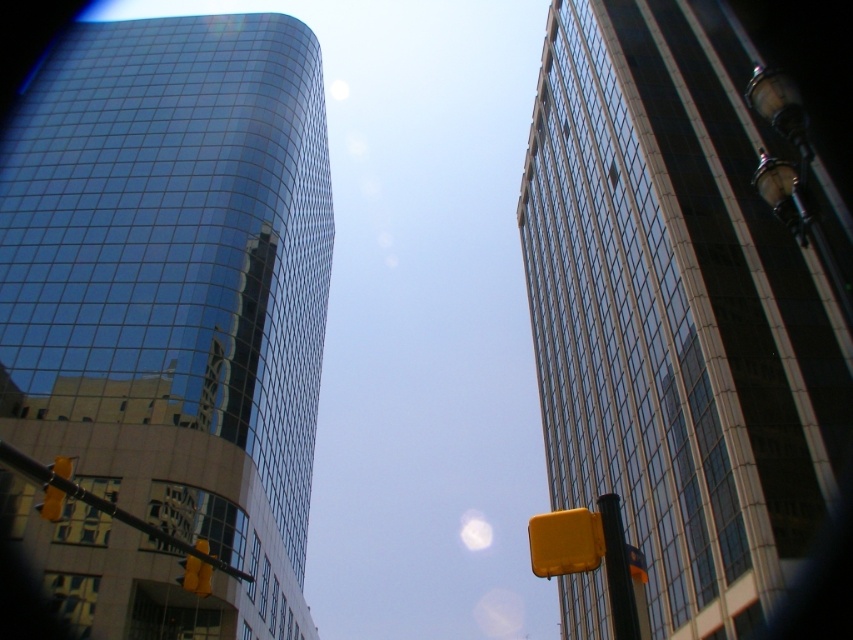
Is glassy reflective skyscraper at right above yellow matte traffic light at center?

Yes.

Which is behind, point (583, 141) or point (544, 547)?

Point (583, 141)

Find the location of a particular element. glassy reflective skyscraper at right is located at coordinates (676, 312).

In order to click on yellow plastic pole at lower left in this screenshot , I will do `click(102, 504)`.

Is yellow plastic pole at lower left wider than yellow plastic traffic light at left?

Correct, the width of yellow plastic pole at lower left exceeds that of yellow plastic traffic light at left.

I want to click on yellow plastic pole at lower left, so click(x=102, y=504).

Is the position of glassy reflective skyscraper at right less distant than that of metallic yellow traffic light at right?

That is False.

Does glassy reflective skyscraper at right have a greater width compared to metallic yellow traffic light at right?

Yes, glassy reflective skyscraper at right is wider than metallic yellow traffic light at right.

Who is more forward, (616, 108) or (613, 618)?

Point (613, 618) is in front.

Where is `glassy reflective skyscraper at right`? glassy reflective skyscraper at right is located at coordinates (676, 312).